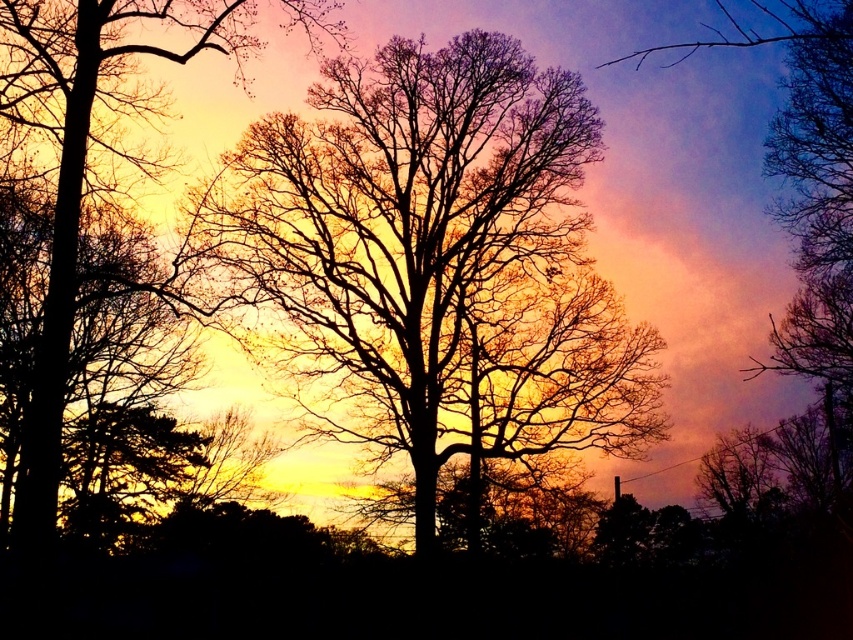
Does silhouette tree at center appear on the left side of silhouette tree at left?

In fact, silhouette tree at center is to the right of silhouette tree at left.

Can you confirm if silhouette tree at center is positioned above silhouette tree at left?

Yes.

Locate an element on the screen. silhouette tree at center is located at coordinates (437, 262).

You are a GUI agent. You are given a task and a screenshot of the screen. Output one action in this format:
    pyautogui.click(x=<x>, y=<y>)
    Task: Click on the silhouette tree at center
    
    Given the screenshot: What is the action you would take?
    pyautogui.click(x=437, y=262)